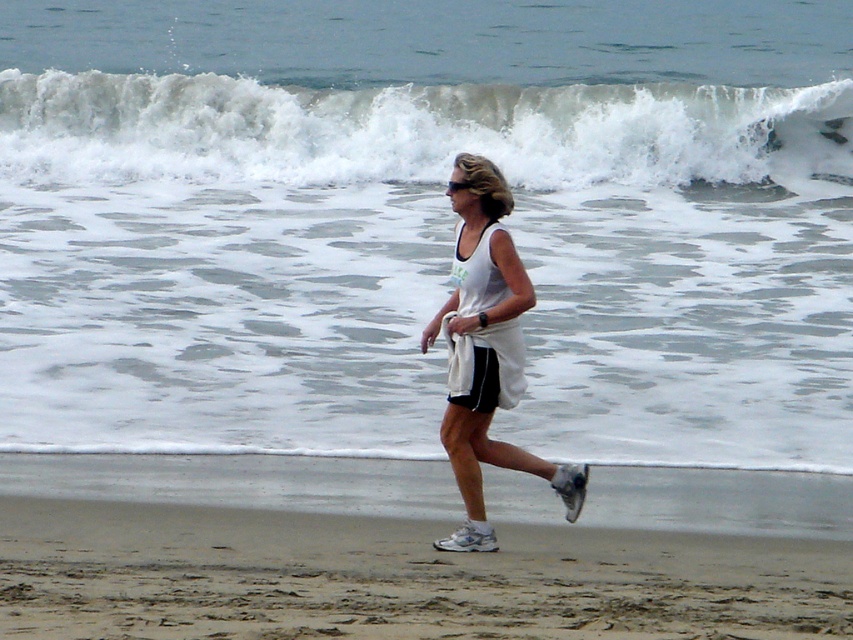
Question: Is sandy brown at lower center further to the viewer compared to white frothy wave at upper center?

Choices:
 (A) yes
 (B) no

Answer: (B)

Question: Can you confirm if white frothy wave at upper center is wider than white fabric tank top at center?

Choices:
 (A) yes
 (B) no

Answer: (B)

Question: Does sandy brown at lower center have a larger size compared to white frothy wave at upper center?

Choices:
 (A) yes
 (B) no

Answer: (A)

Question: Based on their relative distances, which object is nearer to the white frothy wave at upper center?

Choices:
 (A) sandy brown at lower center
 (B) white fabric tank top at center

Answer: (B)

Question: Which point appears closest to the camera in this image?

Choices:
 (A) (339, 611)
 (B) (61, 163)

Answer: (A)

Question: Which is nearer to the white frothy wave at upper center?

Choices:
 (A) sandy brown at lower center
 (B) white fabric tank top at center

Answer: (B)